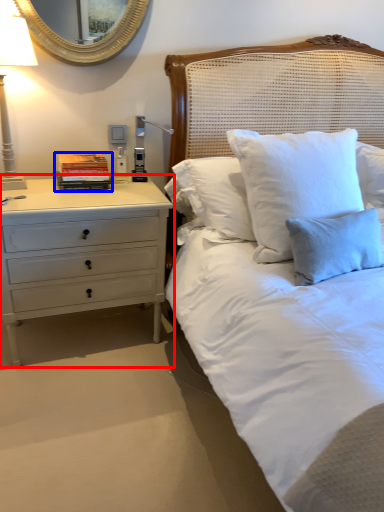
Question: Among these objects, which one is farthest to the camera, chest of drawers (highlighted by a red box) or book (highlighted by a blue box)?

Choices:
 (A) chest of drawers
 (B) book

Answer: (B)